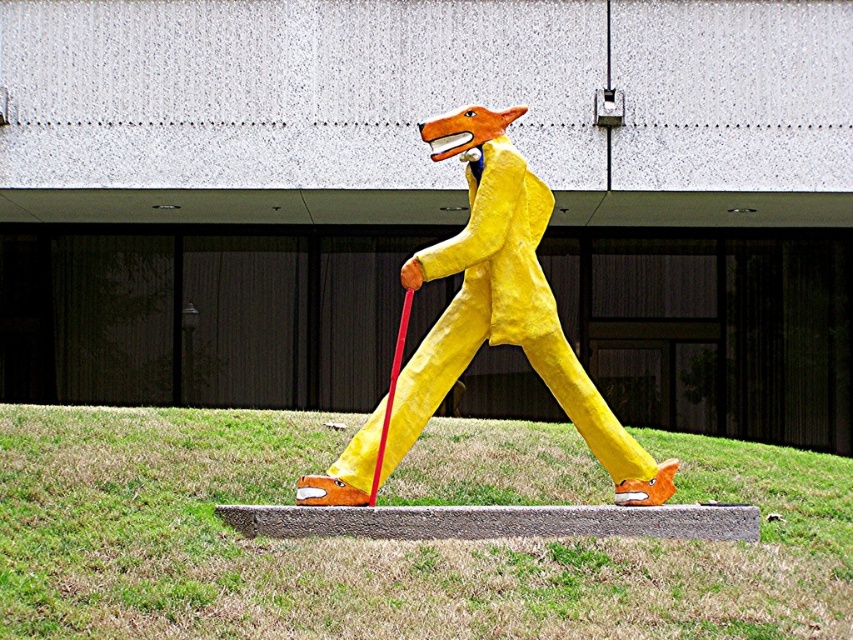
Measure the distance from green grass at center to yellow paper mache fox at center.

A distance of 6.07 feet exists between green grass at center and yellow paper mache fox at center.

Is green grass at center thinner than yellow paper mache fox at center?

Yes.

Locate an element on the screen. The height and width of the screenshot is (640, 853). green grass at center is located at coordinates (381, 541).

Locate an element on the screen. green grass at center is located at coordinates (381, 541).